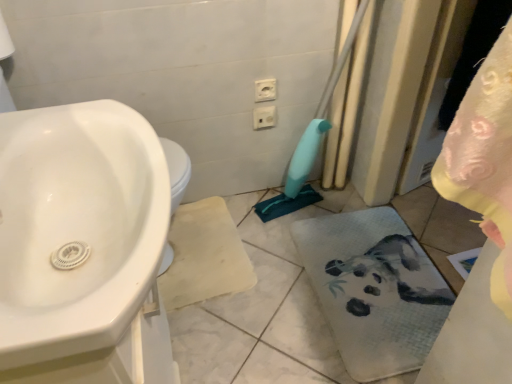
Question: Does white glossy sink at left contain white plastic electric outlet at upper center, which is the second electric outlet in front-to-back order?

Choices:
 (A) yes
 (B) no

Answer: (B)

Question: Considering the relative sizes of white glossy sink at left and white plastic electric outlet at upper center, which is the second electric outlet in front-to-back order, in the image provided, is white glossy sink at left smaller than white plastic electric outlet at upper center, which is the second electric outlet in front-to-back order,?

Choices:
 (A) no
 (B) yes

Answer: (A)

Question: Is white glossy sink at left next to white plastic electric outlet at upper center, positioned as the 1th electric outlet in back-to-front order, and touching it?

Choices:
 (A) no
 (B) yes

Answer: (A)

Question: Considering the relative sizes of white glossy sink at left and white plastic electric outlet at upper center, which is the 1th electric outlet from bottom to top, in the image provided, is white glossy sink at left wider than white plastic electric outlet at upper center, which is the 1th electric outlet from bottom to top,?

Choices:
 (A) yes
 (B) no

Answer: (A)

Question: Is the position of white glossy sink at left more distant than that of white plastic electric outlet at upper center, positioned as the 1th electric outlet in back-to-front order?

Choices:
 (A) yes
 (B) no

Answer: (B)

Question: Is point (93, 304) positioned closer to the camera than point (355, 357)?

Choices:
 (A) farther
 (B) closer

Answer: (B)

Question: In terms of width, does white glossy sink at left look wider or thinner when compared to white fabric bath towel at lower right?

Choices:
 (A) wide
 (B) thin

Answer: (B)

Question: In terms of size, does white glossy sink at left appear bigger or smaller than white fabric bath towel at lower right?

Choices:
 (A) big
 (B) small

Answer: (A)

Question: Which is correct: white glossy sink at left is inside white fabric bath towel at lower right, or outside of it?

Choices:
 (A) inside
 (B) outside

Answer: (B)

Question: Based on their sizes in the image, would you say white plastic electric outlet at upper center, positioned as the 1th electric outlet in back-to-front order, is bigger or smaller than white glossy sink at left?

Choices:
 (A) small
 (B) big

Answer: (A)

Question: From the image's perspective, relative to white glossy sink at left, is white plastic electric outlet at upper center, positioned as the 1th electric outlet in back-to-front order, above or below?

Choices:
 (A) below
 (B) above

Answer: (B)

Question: Based on their positions, is white plastic electric outlet at upper center, positioned as the 1th electric outlet in back-to-front order, located to the left or right of white glossy sink at left?

Choices:
 (A) left
 (B) right

Answer: (B)

Question: Do you think white plastic electric outlet at upper center, the second electric outlet positioned from the top, is within white glossy sink at left, or outside of it?

Choices:
 (A) inside
 (B) outside

Answer: (B)

Question: From the image's perspective, is white plastic electric outlet at upper center, which appears as the 1th electric outlet when viewed from the top, located above or below white plastic electric outlet at upper center, the second electric outlet positioned from the top?

Choices:
 (A) below
 (B) above

Answer: (B)

Question: Considering the positions of point (261, 97) and point (272, 119), is point (261, 97) closer or farther from the camera than point (272, 119)?

Choices:
 (A) closer
 (B) farther

Answer: (A)